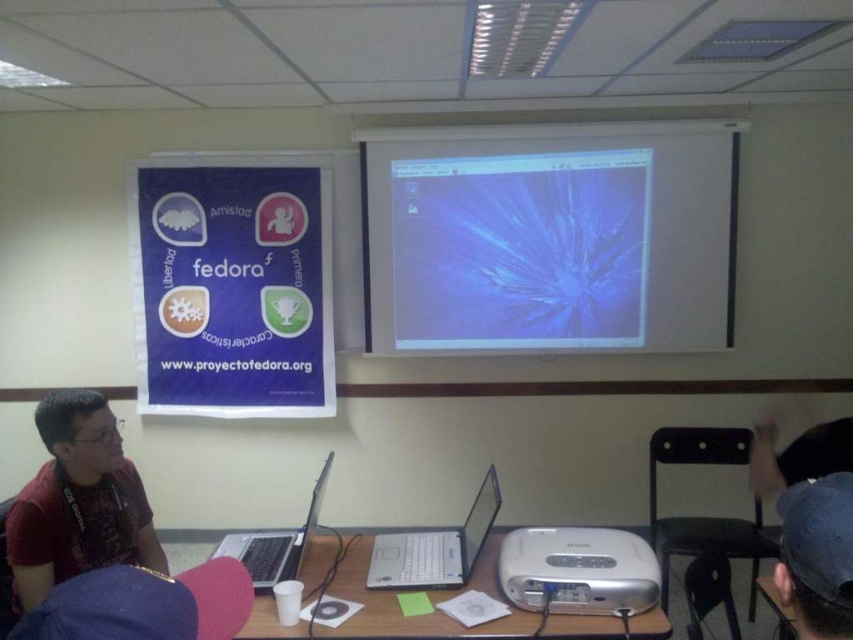
Which is more to the right, matte paper poster at upper left or black fabric cap at upper right?

From the viewer's perspective, black fabric cap at upper right appears more on the right side.

Between matte paper poster at upper left and black fabric cap at upper right, which one has more height?

matte paper poster at upper left

Locate an element on the screen. This screenshot has width=853, height=640. matte paper poster at upper left is located at coordinates (233, 291).

Which is more to the left, matte paper poster at upper left or matte red shirt at left?

matte paper poster at upper left

Is point (291, 362) behind point (59, 484)?

Yes, point (291, 362) is farther from viewer.

Locate an element on the screen. This screenshot has height=640, width=853. matte paper poster at upper left is located at coordinates (233, 291).

Can you confirm if matte paper poster at upper left is smaller than silver metallic laptop at center?

Incorrect, matte paper poster at upper left is not smaller in size than silver metallic laptop at center.

What do you see at coordinates (233, 291) in the screenshot? I see `matte paper poster at upper left` at bounding box center [233, 291].

Identify the location of matte paper poster at upper left. Image resolution: width=853 pixels, height=640 pixels. (233, 291).